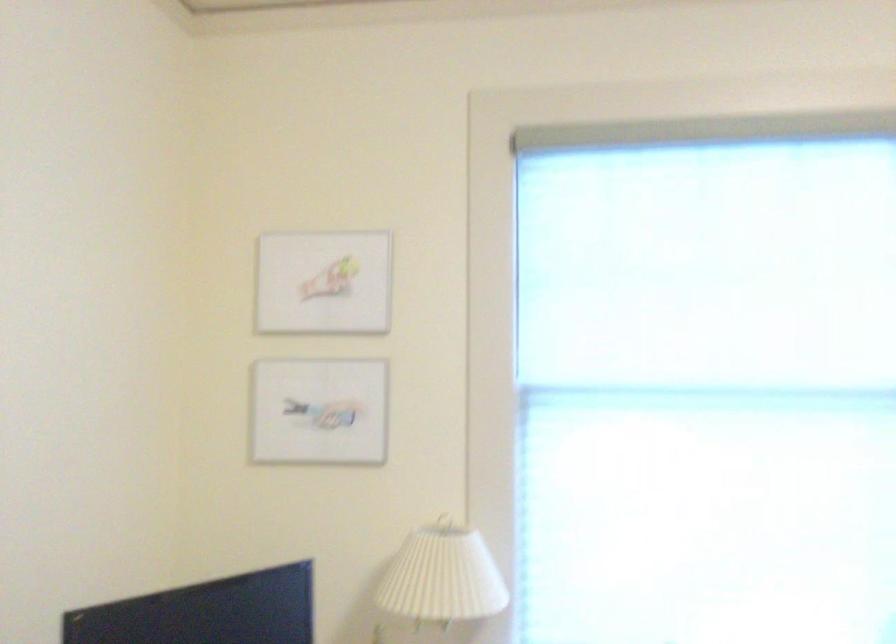
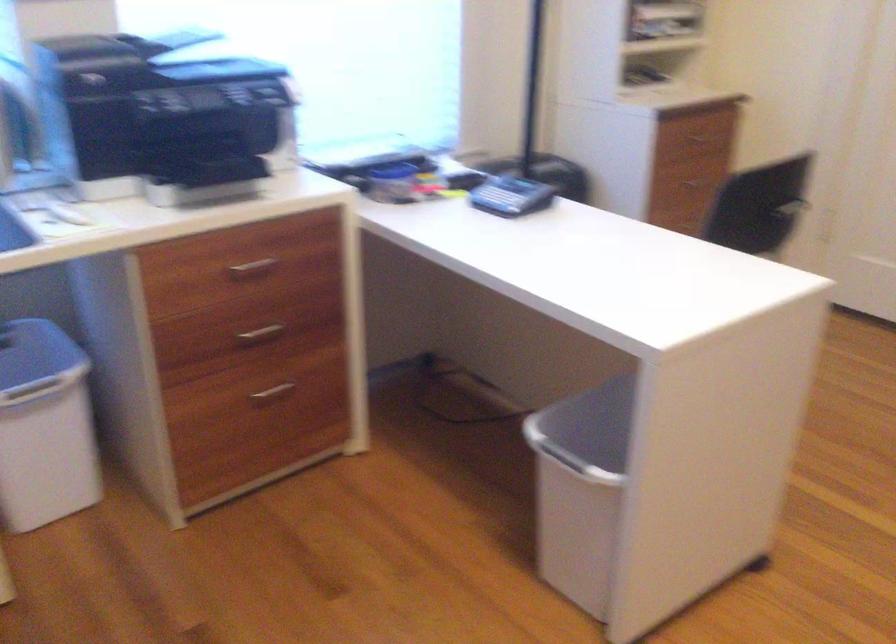
The first image is from the beginning of the video and the second image is from the end. How did the camera likely rotate when shooting the video?

The camera rotated toward right-down.